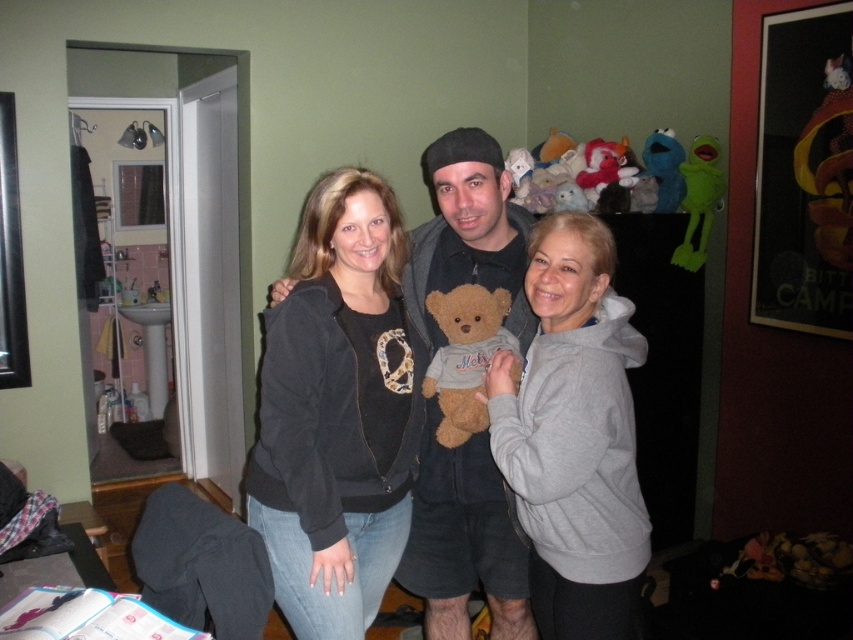
Is point (546, 417) positioned in front of point (503, 317)?

Yes, point (546, 417) is closer to viewer.

In the scene shown: Which is more to the right, gray fleece sweatshirt at center or brown plush teddy bear at center?

gray fleece sweatshirt at center is more to the right.

Describe the element at coordinates (573, 436) in the screenshot. I see `gray fleece sweatshirt at center` at that location.

Identify the location of gray fleece sweatshirt at center. (573, 436).

Which is behind, point (526, 310) or point (668, 145)?

The point (668, 145) is behind.

Does soft gray hoodie at center have a larger size compared to blue plush toy at upper right?

Correct, soft gray hoodie at center is larger in size than blue plush toy at upper right.

Who is more distant from viewer, (454, 224) or (676, 180)?

The point (676, 180) is more distant.

The width and height of the screenshot is (853, 640). Identify the location of soft gray hoodie at center. (463, 540).

Between gray fleece sweatshirt at center and soft gray hoodie at center, which one has more height?

soft gray hoodie at center

Is gray fleece sweatshirt at center shorter than soft gray hoodie at center?

Correct, gray fleece sweatshirt at center is not as tall as soft gray hoodie at center.

Is point (585, 276) positioned before point (515, 291)?

Yes.

This screenshot has height=640, width=853. What are the coordinates of `gray fleece sweatshirt at center` in the screenshot? It's located at (573, 436).